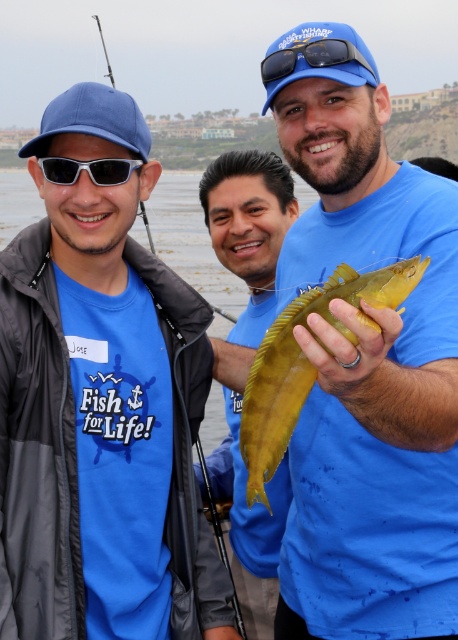
You are a photographer at the scene. You need to capture a photo of both the matte yellow fish at center and the yellow matte fish at center. However, you only have a small frame in your camera. Which fish should you focus on to ensure both fit in the frame?

The matte yellow fish at center is larger than the yellow matte fish at center. To ensure both fit in the frame, focus on the larger one first, then adjust the frame to include the smaller one.